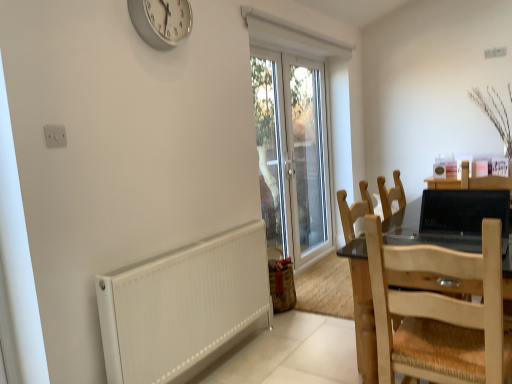
Question: Considering their positions, is transparent glass door at center located in front of or behind silver metallic clock at upper center?

Choices:
 (A) behind
 (B) front

Answer: (A)

Question: Visually, is transparent glass door at center positioned to the left or to the right of silver metallic clock at upper center?

Choices:
 (A) left
 (B) right

Answer: (B)

Question: Estimate the real-world distances between objects in this image. Which object is closer to the transparent glass door at center?

Choices:
 (A) natural wood chair at right, which is counted as the 1th chair, starting from the front
 (B) light brown wooden chair at right, which is counted as the 2th chair, starting from the front
 (C) white textured radiator at lower left
 (D) black glossy laptop at right
 (E) transparent glass door at center

Answer: (E)

Question: Which object is positioned farthest from the white textured radiator at lower left?

Choices:
 (A) natural wood chair at right, which is counted as the 1th chair, starting from the front
 (B) light brown wooden chair at right, which is counted as the first chair, starting from the back
 (C) black glossy laptop at right
 (D) transparent glass door at center
 (E) transparent glass door at center

Answer: (D)